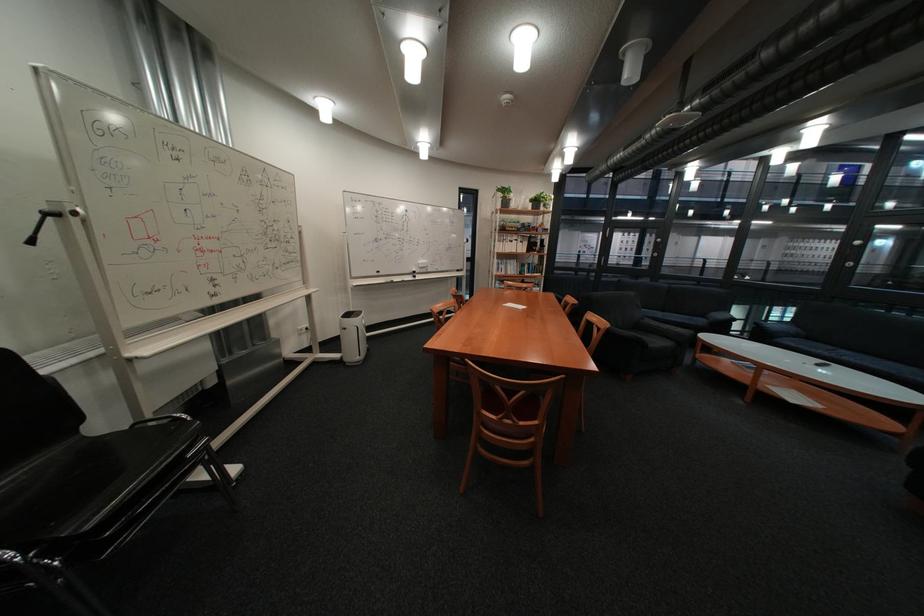
Which object does [421,262] point to?

It refers to a whiteboard eraser.